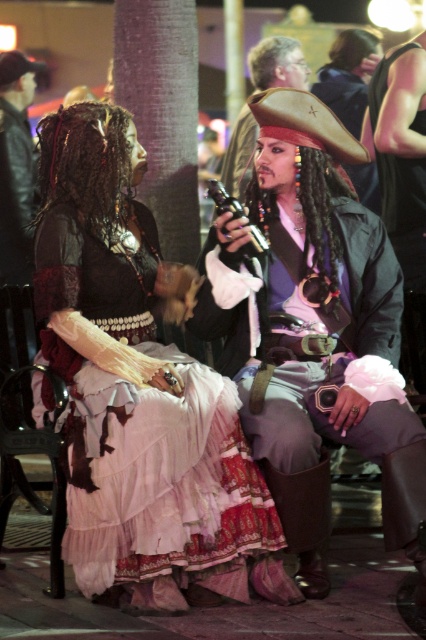
Question: Can you confirm if ruffled lace dress at center is bigger than shiny gold pirate hat at center?

Choices:
 (A) no
 (B) yes

Answer: (B)

Question: Is leather pirate hat at center to the left of shiny gold pirate hat at center from the viewer's perspective?

Choices:
 (A) yes
 (B) no

Answer: (B)

Question: Which point is farther from the camera taking this photo?

Choices:
 (A) (239, 124)
 (B) (170, 605)
 (C) (365, 348)

Answer: (A)

Question: Which object is farther from the camera taking this photo?

Choices:
 (A) shiny gold pirate hat at center
 (B) shiny black vest at right
 (C) ruffled lace dress at center

Answer: (B)

Question: Estimate the real-world distances between objects in this image. Which object is closer to the shiny gold pirate hat at center?

Choices:
 (A) ruffled lace dress at center
 (B) shiny black vest at right

Answer: (B)

Question: Does leather pirate hat at center lie behind shiny black vest at right?

Choices:
 (A) no
 (B) yes

Answer: (A)